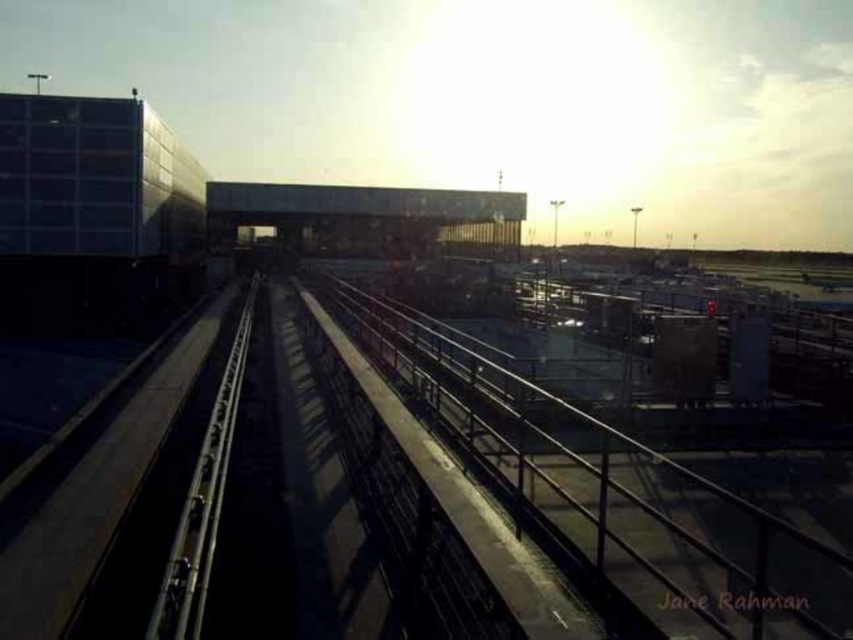
Question: Which point appears closest to the camera in this image?

Choices:
 (A) (440, 230)
 (B) (563, 449)

Answer: (B)

Question: Which object is closer to the camera taking this photo?

Choices:
 (A) metallic smooth train track at center
 (B) dark gray concrete overpass at center

Answer: (A)

Question: Does dark gray concrete overpass at center have a greater width compared to metallic smooth train track at center?

Choices:
 (A) no
 (B) yes

Answer: (B)

Question: Is metallic gray train track at center bigger than dark gray concrete overpass at center?

Choices:
 (A) no
 (B) yes

Answer: (A)

Question: In this image, where is metallic gray train track at center located relative to metallic smooth train track at center?

Choices:
 (A) above
 (B) below

Answer: (A)

Question: Which is nearer to the metallic gray train track at center?

Choices:
 (A) dark gray concrete overpass at center
 (B) metallic smooth train track at center

Answer: (B)